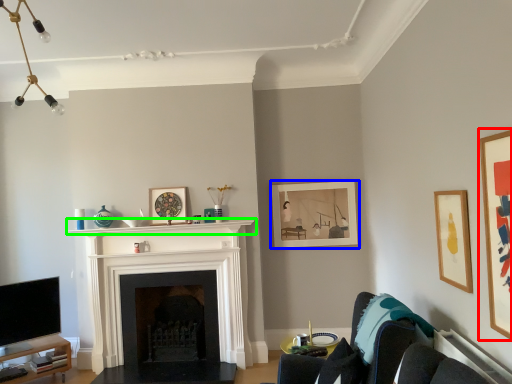
Question: Based on their relative distances, which object is farther from picture frame (highlighted by a red box)? Choose from picture frame (highlighted by a blue box) and mantle (highlighted by a green box).

Choices:
 (A) picture frame
 (B) mantle

Answer: (B)